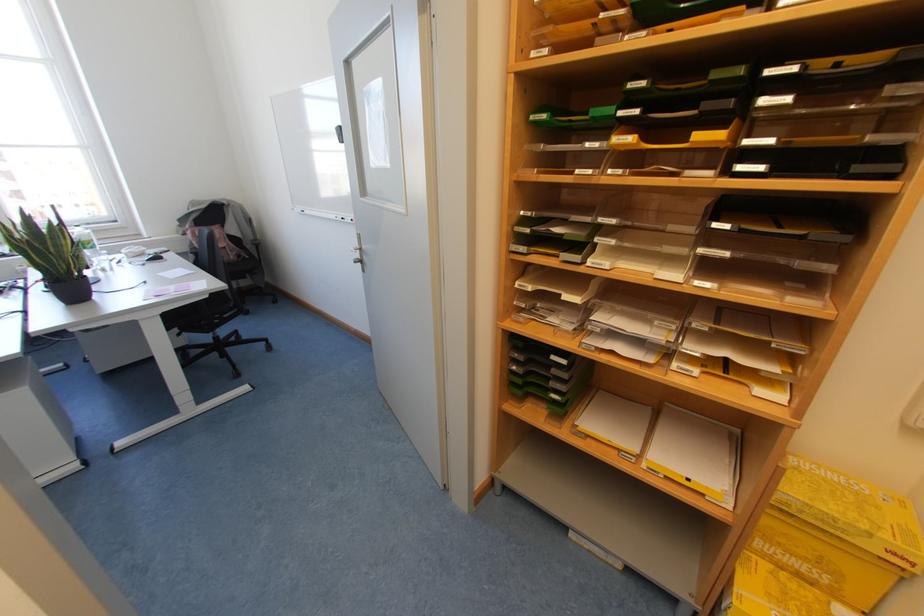
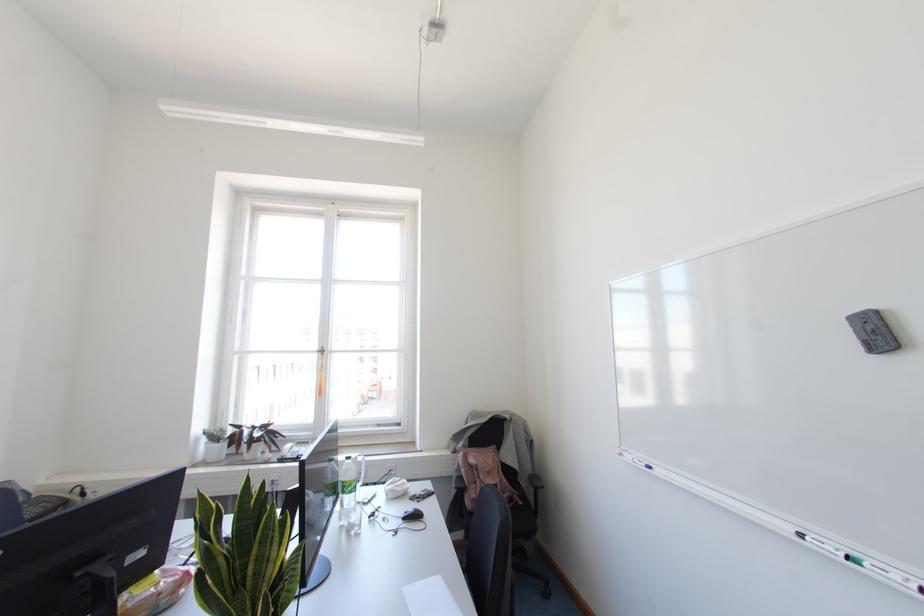
In the second image, find the point that corresponds to point (82, 244) in the first image.

(343, 485)